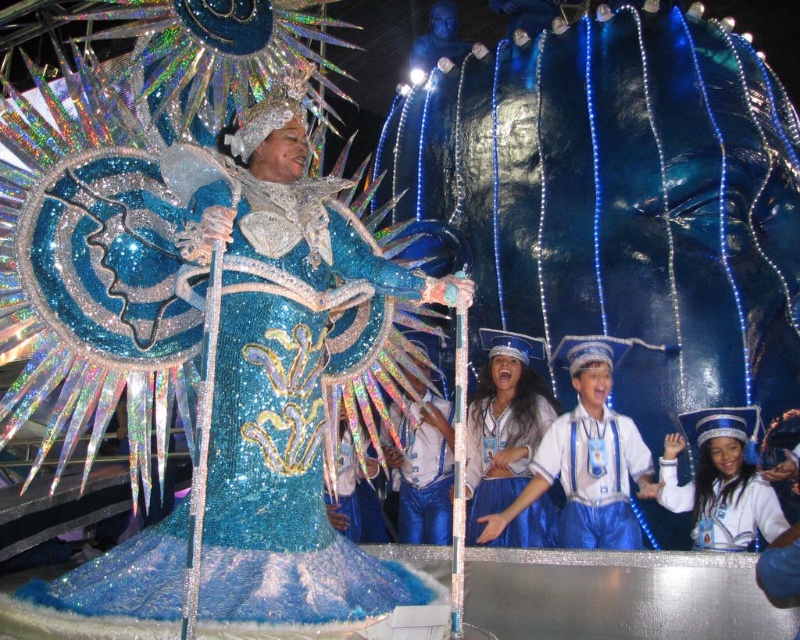
Image resolution: width=800 pixels, height=640 pixels. What do you see at coordinates (594, 477) in the screenshot?
I see `blue sequined costume at center` at bounding box center [594, 477].

Measure the distance from blue sequined costume at center to blue sequined pants at center.

14.55 meters

Which is behind, point (608, 500) or point (426, 401)?

Positioned behind is point (426, 401).

The width and height of the screenshot is (800, 640). I want to click on blue sequined costume at center, so click(594, 477).

Which is behind, point (620, 509) or point (730, 444)?

Positioned behind is point (620, 509).

Is shiny blue uniform at center shorter than shiny blue hat at lower right?

No, shiny blue uniform at center is not shorter than shiny blue hat at lower right.

At what (x,y) coordinates should I click in order to perform the action: click on shiny blue uniform at center. Please return your answer as a coordinate pair (x, y). Image resolution: width=800 pixels, height=640 pixels. Looking at the image, I should click on (586, 461).

Does shiny blue hat at lower right have a lesser width compared to blue sequined costume at center?

Indeed, shiny blue hat at lower right has a lesser width compared to blue sequined costume at center.

Who is positioned more to the right, shiny blue hat at lower right or blue sequined costume at center?

From the viewer's perspective, shiny blue hat at lower right appears more on the right side.

Who is more forward, [744,534] or [618,524]?

Point [744,534] is in front.

Identify the location of shiny blue hat at lower right. This screenshot has height=640, width=800. (720, 481).